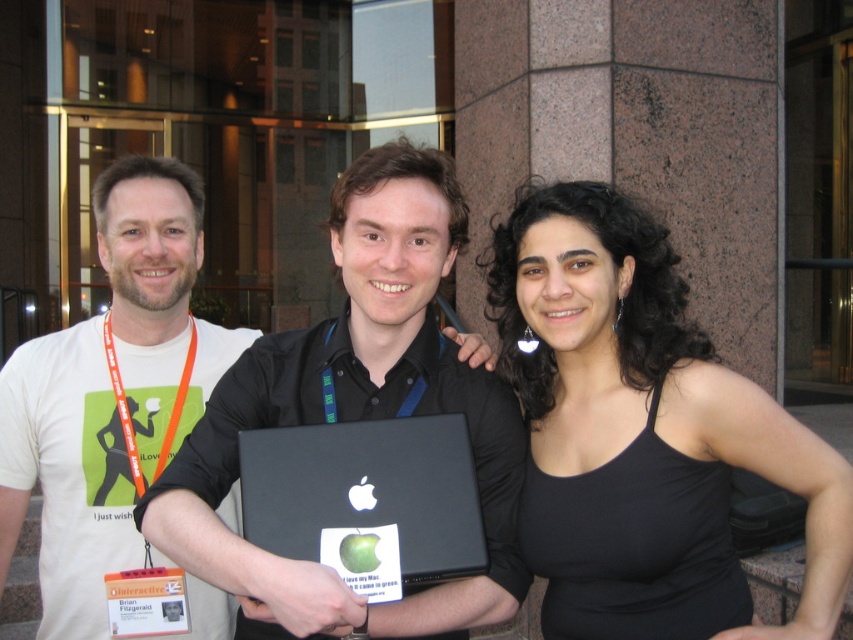
Question: Based on their relative distances, which object is farther from the white matte t-shirt at left?

Choices:
 (A) black matte tank top at center
 (B) matte black laptop at center

Answer: (A)

Question: Considering the relative positions of matte black laptop at center and white matte t-shirt at left in the image provided, where is matte black laptop at center located with respect to white matte t-shirt at left?

Choices:
 (A) below
 (B) above

Answer: (B)

Question: Which of the following is the farthest from the observer?

Choices:
 (A) pos(45,403)
 (B) pos(676,432)
 (C) pos(352,579)

Answer: (A)

Question: Which of the following is the closest to the observer?

Choices:
 (A) matte black laptop at center
 (B) black matte laptop at center

Answer: (A)

Question: Considering the relative positions of white matte t-shirt at left and black matte laptop at center in the image provided, where is white matte t-shirt at left located with respect to black matte laptop at center?

Choices:
 (A) below
 (B) above

Answer: (B)

Question: Observing the image, what is the correct spatial positioning of matte black laptop at center in reference to black matte laptop at center?

Choices:
 (A) left
 (B) right

Answer: (A)